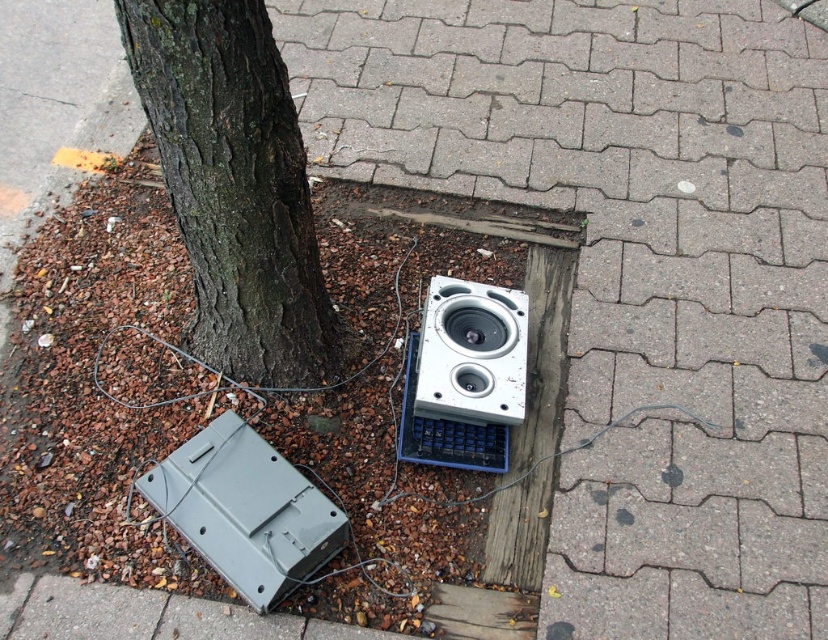
Is gray matte television at lower left further to camera compared to white plastic speaker at center?

No.

Which is in front, point (172, 504) or point (518, 417)?

Point (172, 504)

You are a GUI agent. You are given a task and a screenshot of the screen. Output one action in this format:
    pyautogui.click(x=<x>, y=<y>)
    Task: Click on the gray matte television at lower left
    This screenshot has width=828, height=640.
    Given the screenshot: What is the action you would take?
    pyautogui.click(x=244, y=509)

Does dark brown bark at center have a lesser width compared to gray matte television at lower left?

Yes, dark brown bark at center is thinner than gray matte television at lower left.

Is dark brown bark at center bigger than gray matte television at lower left?

Yes.

Does point (205, 24) come farther from viewer compared to point (249, 476)?

No, (205, 24) is in front of (249, 476).

Locate an element on the screen. dark brown bark at center is located at coordinates (234, 188).

Can you confirm if dark brown bark at center is thinner than white plastic speaker at center?

No.

Which is below, dark brown bark at center or white plastic speaker at center?

white plastic speaker at center is lower down.

Locate an element on the screen. dark brown bark at center is located at coordinates (234, 188).